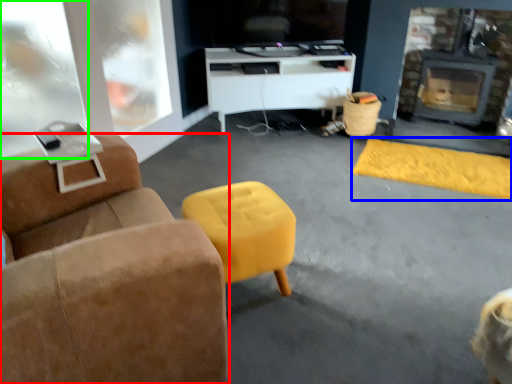
Question: Which object is positioned closest to furniture (highlighted by a red box)? Select from flat (highlighted by a blue box) and glass door (highlighted by a green box).

Choices:
 (A) flat
 (B) glass door

Answer: (B)